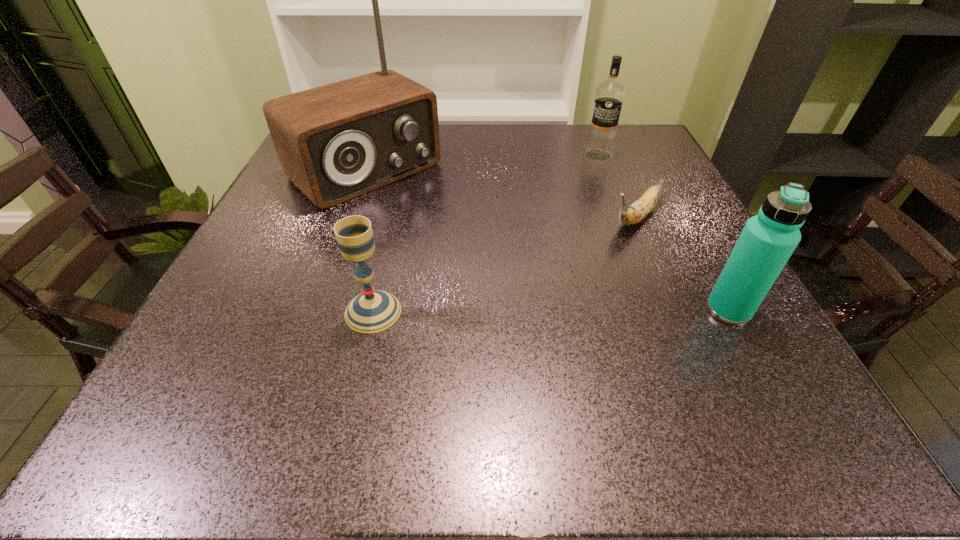
I want to click on chalice, so click(x=372, y=311).

Identify the location of water bottle. (767, 241).

You are a GUI agent. You are given a task and a screenshot of the screen. Output one action in this format:
    pyautogui.click(x=<x>, y=<y>)
    Task: Click on the vodka
    This screenshot has width=960, height=540.
    Given the screenshot: What is the action you would take?
    pyautogui.click(x=609, y=95)

At what (x,y) coordinates should I click in order to perform the action: click on the tallest object. Please return your answer as a coordinate pair (x, y). The width and height of the screenshot is (960, 540). Looking at the image, I should click on (335, 142).

I want to click on the shortest object, so click(629, 215).

The height and width of the screenshot is (540, 960). In order to click on free space located on the front of the chalice in this screenshot , I will do `click(360, 370)`.

Locate an element on the screen. The image size is (960, 540). free region located 0.080m on the back of the water bottle is located at coordinates (704, 264).

Image resolution: width=960 pixels, height=540 pixels. Find the location of `vacant position located on the label of the vodka`. vacant position located on the label of the vodka is located at coordinates (577, 208).

The width and height of the screenshot is (960, 540). What are the coordinates of `free spot located on the label of the vodka` in the screenshot? It's located at (588, 180).

Where is `free location located 0.100m on the label of the vodka`? free location located 0.100m on the label of the vodka is located at coordinates (587, 183).